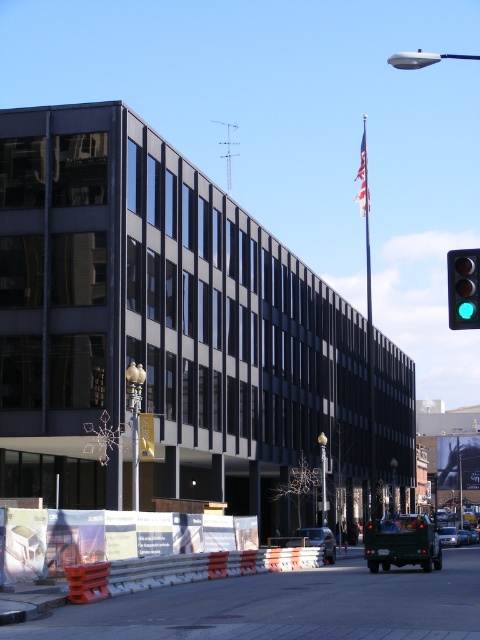
Which is more to the right, green glass traffic light at right or silver metallic sedan at center?

From the viewer's perspective, silver metallic sedan at center appears more on the right side.

Is green glass traffic light at right taller than silver metallic sedan at center?

Indeed, green glass traffic light at right has a greater height compared to silver metallic sedan at center.

Between point (463, 308) and point (452, 528), which one is positioned in front?

Point (463, 308) is in front.

This screenshot has width=480, height=640. I want to click on green glass traffic light at right, so click(464, 289).

Does shiny silver sedan at center lie in front of silver metallic sedan at center?

Yes, shiny silver sedan at center is closer to the viewer.

Does shiny silver sedan at center lie behind silver metallic sedan at center?

No.

Where is `shiny silver sedan at center`? shiny silver sedan at center is located at coordinates (315, 540).

The image size is (480, 640). Identify the location of shiny silver sedan at center. (315, 540).

Does orange plastic barrier at lower center have a greater width compared to shiny silver sedan at center?

Correct, the width of orange plastic barrier at lower center exceeds that of shiny silver sedan at center.

Is orange plastic barrier at lower center to the right of shiny silver sedan at center from the viewer's perspective?

No, orange plastic barrier at lower center is not to the right of shiny silver sedan at center.

Is point (107, 586) in front of point (324, 554)?

Yes, it is.

This screenshot has width=480, height=640. I want to click on orange plastic barrier at lower center, so click(180, 570).